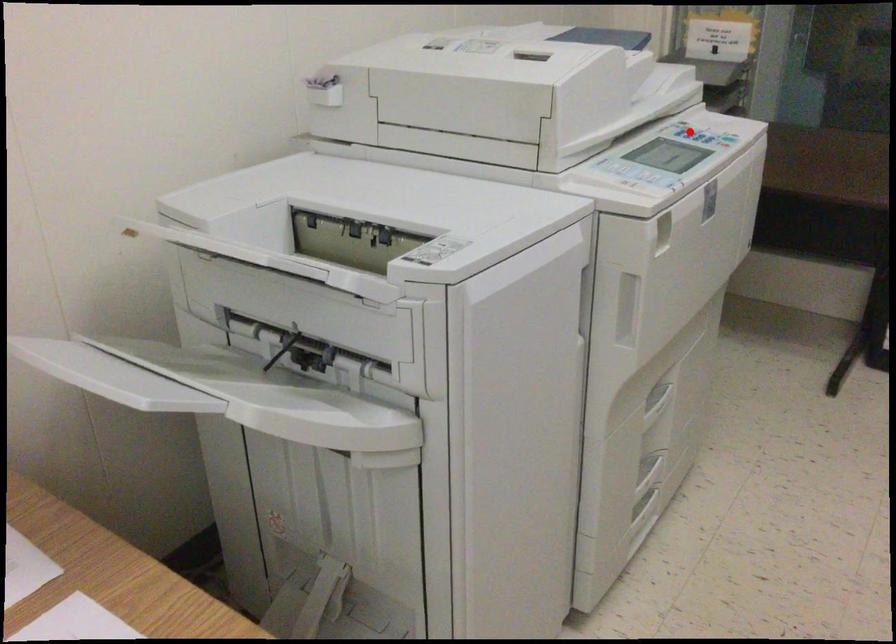
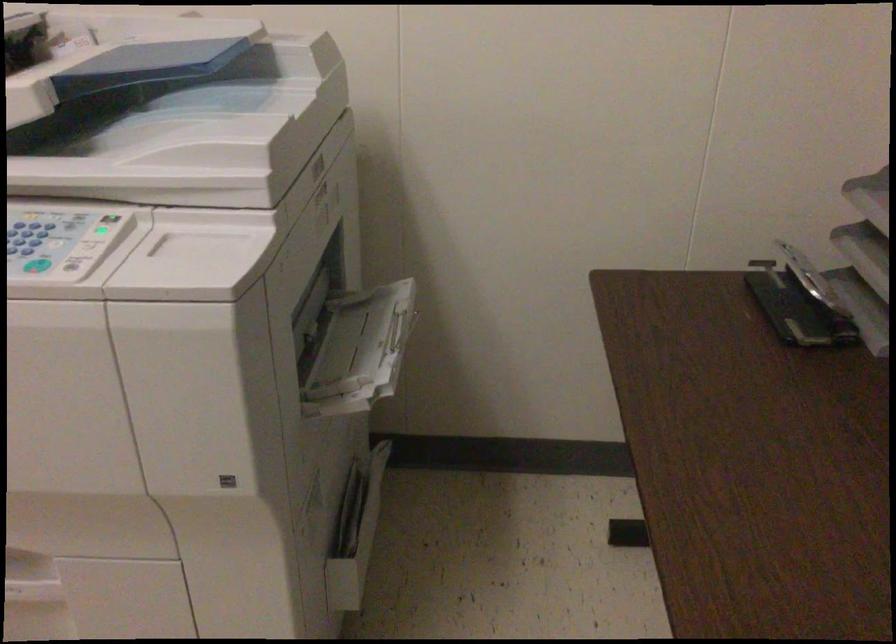
Question: A red point is marked in image1. In image2, is the corresponding 3D point closer to the camera or farther? Reply with the corresponding letter.

Choices:
 (A) The corresponding 3D point is closer.
 (B) The corresponding 3D point is farther.

Answer: (A)